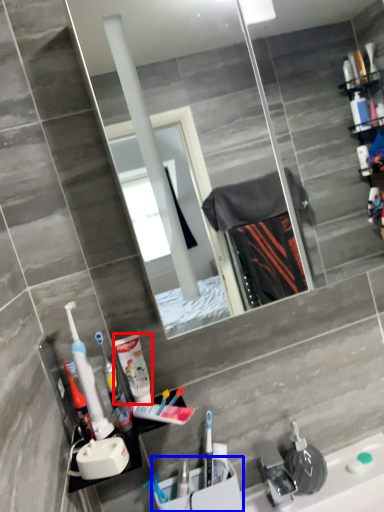
Question: Which object appears farthest to the camera in this image, cleaning product (highlighted by a red box) or sink (highlighted by a blue box)?

Choices:
 (A) cleaning product
 (B) sink

Answer: (B)